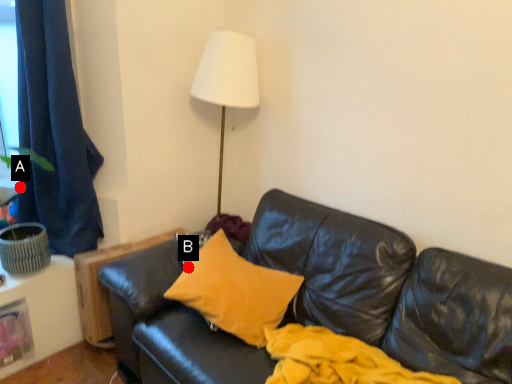
Question: Two points are circled on the image, labeled by A and B beside each circle. Among these points, which one is farthest from the camera?

Choices:
 (A) A is further
 (B) B is further

Answer: (A)